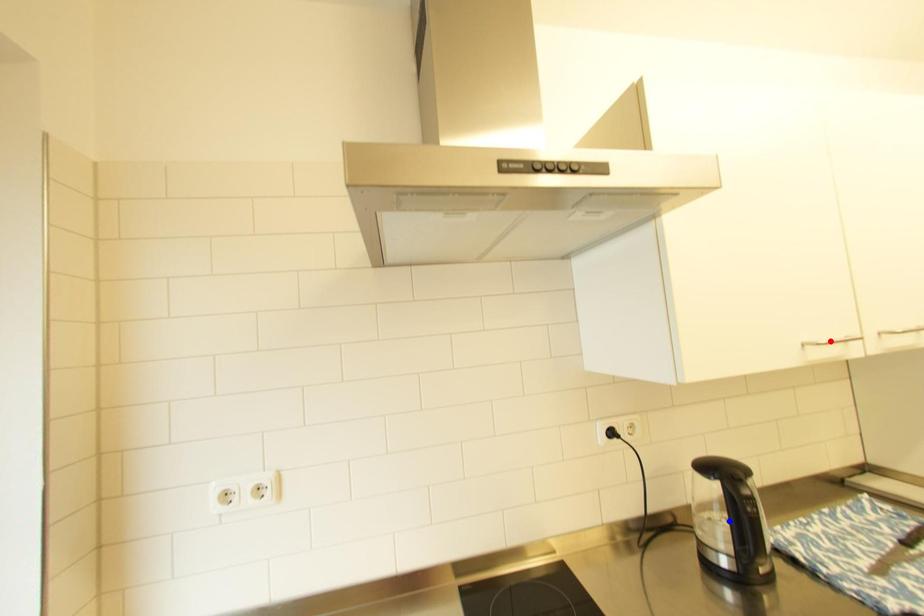
Question: Two points are marked on the image. Which point is closer to the camera?

Choices:
 (A) Blue point is closer.
 (B) Red point is closer.

Answer: (B)